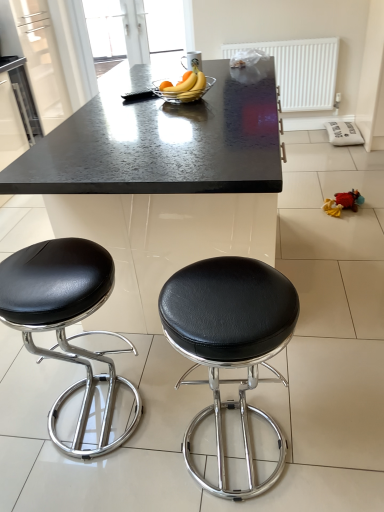
Image resolution: width=384 pixels, height=512 pixels. Find the location of `free space above black leather stool at left, the 2th stool positioned from the right (from a real-world perspective)`. free space above black leather stool at left, the 2th stool positioned from the right (from a real-world perspective) is located at coordinates tap(43, 271).